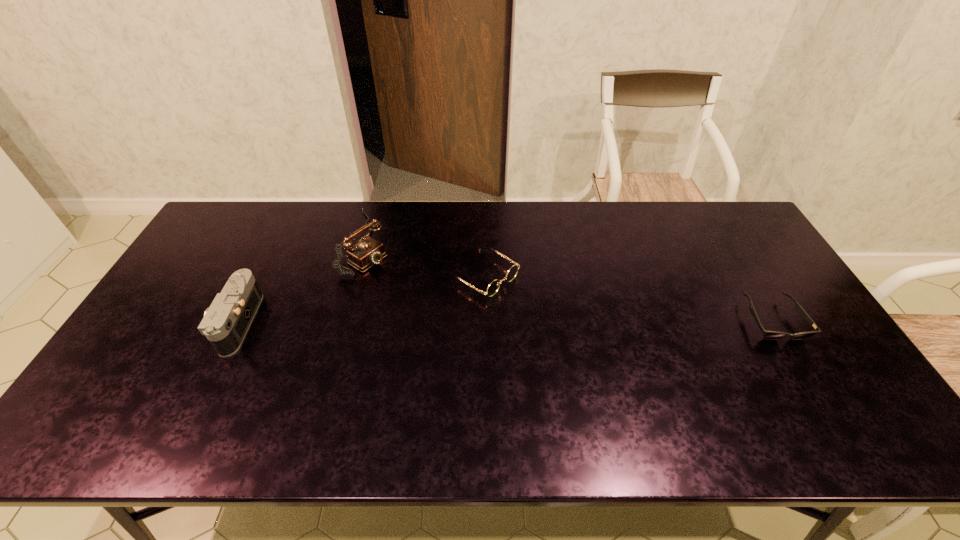
Locate an element on the screen. free space on the desktop that is between the leftmost object and the sunglasses and is positioned on the dial of the telephone is located at coordinates (500, 321).

Locate an element on the screen. The height and width of the screenshot is (540, 960). vacant spot on the desktop that is between the leftmost object and the shortest object and is positioned on the lenses of the third object from left to right is located at coordinates pos(554,321).